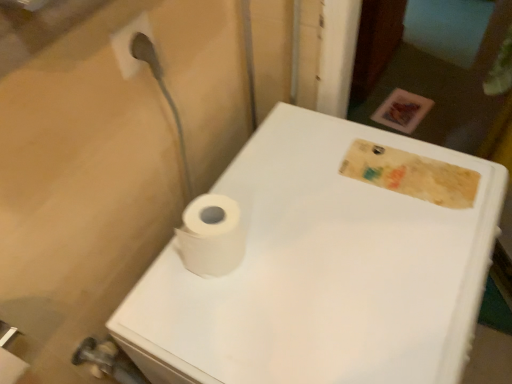
Question: Based on their sizes in the image, would you say white matte porcelain at center is bigger or smaller than white matte toilet paper at center?

Choices:
 (A) small
 (B) big

Answer: (B)

Question: From a real-world perspective, is white matte porcelain at center above or below white matte toilet paper at center?

Choices:
 (A) below
 (B) above

Answer: (A)

Question: From the image's perspective, is white matte porcelain at center positioned above or below white matte toilet paper at center?

Choices:
 (A) below
 (B) above

Answer: (A)

Question: In the image, is white matte toilet paper at center on the left side or the right side of white matte porcelain at center?

Choices:
 (A) left
 (B) right

Answer: (A)

Question: From a real-world perspective, relative to white matte porcelain at center, is white matte toilet paper at center vertically above or below?

Choices:
 (A) below
 (B) above

Answer: (B)

Question: Considering the positions of point coord(186,240) and point coord(168,249), is point coord(186,240) closer or farther from the camera than point coord(168,249)?

Choices:
 (A) closer
 (B) farther

Answer: (A)

Question: In the image, is white matte toilet paper at center positioned in front of or behind white matte porcelain at center?

Choices:
 (A) behind
 (B) front

Answer: (A)